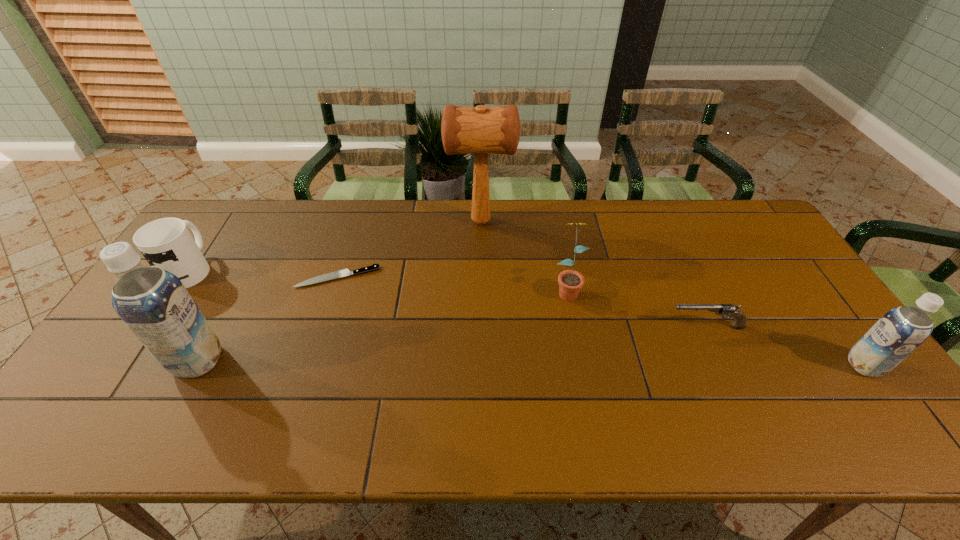
At what (x,y) coordinates should I click in order to perform the action: click on empty space that is in between the left soya milk and the steak knife. Please return your answer as a coordinate pair (x, y). Looking at the image, I should click on (268, 319).

You are a GUI agent. You are given a task and a screenshot of the screen. Output one action in this format:
    pyautogui.click(x=<x>, y=<y>)
    Task: Click on the vacant space in between the rightmost object and the steak knife
    
    Given the screenshot: What is the action you would take?
    pyautogui.click(x=601, y=321)

Find the location of `free space that is in between the sixth object from right to left and the farthest object`. free space that is in between the sixth object from right to left and the farthest object is located at coordinates (339, 291).

In order to click on free space between the third object from right to left and the leftmost object in this screenshot , I will do `click(378, 279)`.

Identify the location of vacant point located between the fourth object from left to right and the fifth tallest object. (335, 245).

You are a GUI agent. You are given a task and a screenshot of the screen. Output one action in this format:
    pyautogui.click(x=<x>, y=<y>)
    Task: Click on the unoccupied area between the shortest object and the leftmost object
    The height and width of the screenshot is (540, 960).
    Given the screenshot: What is the action you would take?
    pyautogui.click(x=264, y=273)

At what (x,y) coordinates should I click in order to perform the action: click on the fourth closest object to the taller soya milk. Please return your answer as a coordinate pair (x, y). Looking at the image, I should click on point(570,282).

I want to click on object that is the fifth nearest to the second object from left to right, so click(739, 322).

This screenshot has width=960, height=540. I want to click on blank area in the image that satisfies the following two spatial constraints: 1. on the flower of the fifth object from left to right; 2. on the label of the left soya milk, so click(581, 361).